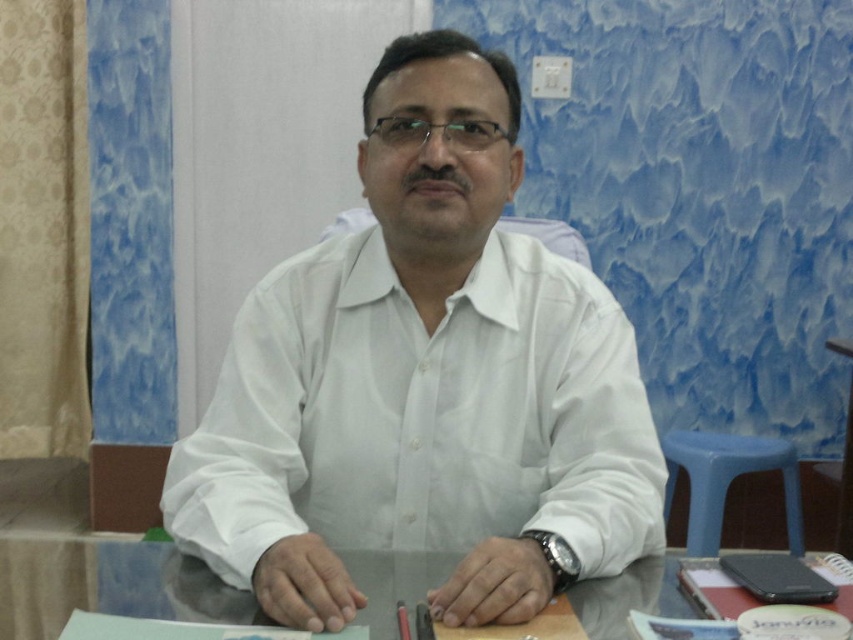
You are an interior designer assessing the office layout. You notice the white smooth shirt at center and the transparent glass table at center. Which object has a smaller thickness?

The white smooth shirt at center is thinner than the transparent glass table at center according to the description.

You are a delivery person who needs to place a small package on the desk without touching the white smooth shirt at center. The package is 8 inches wide. Can you fit it on the desk next to the transparent glass table at center?

The white smooth shirt at center is 7.91 inches from the transparent glass table at center. Since the package is 8 inches wide, it might not fit between them without overlapping. Consider placing it elsewhere on the desk.

You are standing in the office scene and want to move from point A to point B. Point A is at coordinate point (x=200, y=445) and point B is at coordinate point (x=62, y=577). Which point is closer to you, the observer?

Point (x=62, y=577) is closer to you because it is nearer to the camera than point (x=200, y=445).